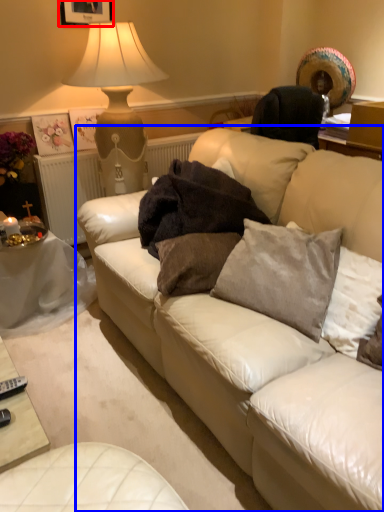
Question: Among these objects, which one is farthest to the camera, picture frame (highlighted by a red box) or studio couch (highlighted by a blue box)?

Choices:
 (A) picture frame
 (B) studio couch

Answer: (A)